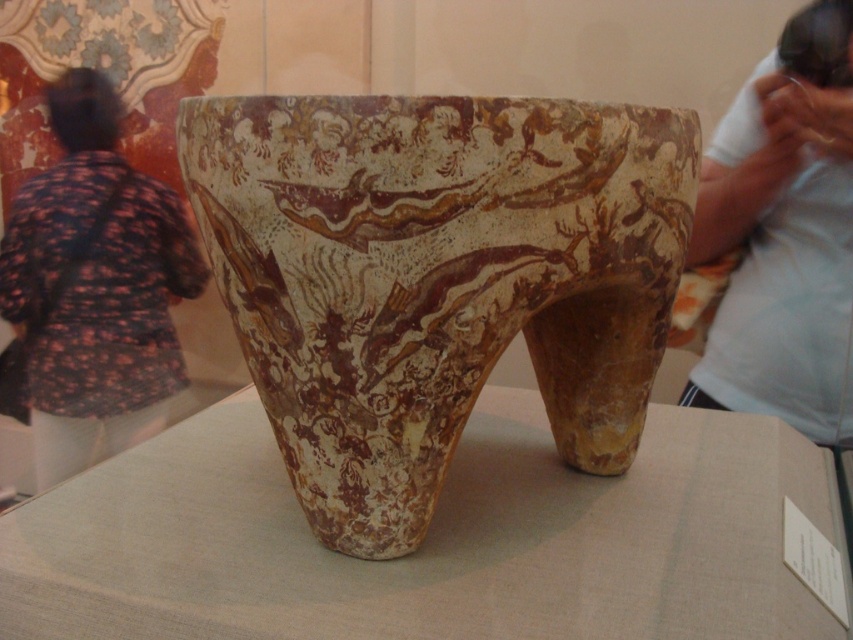
Question: Does brown textured vase at center appear over white cotton shirt at upper right?

Choices:
 (A) yes
 (B) no

Answer: (B)

Question: Can you confirm if brown textured vase at center is thinner than white cotton shirt at upper right?

Choices:
 (A) no
 (B) yes

Answer: (A)

Question: Which object is farther from the camera taking this photo?

Choices:
 (A) brown textured vase at center
 (B) white cotton shirt at upper right
 (C) floral-patterned shirt at left

Answer: (C)

Question: Estimate the real-world distances between objects in this image. Which object is farther from the floral-patterned shirt at left?

Choices:
 (A) brown textured vase at center
 (B) white cotton shirt at upper right

Answer: (A)

Question: Which point is farther to the camera?

Choices:
 (A) (544, 364)
 (B) (80, 403)

Answer: (B)

Question: Is floral-patterned shirt at left further to the viewer compared to white cotton shirt at upper right?

Choices:
 (A) yes
 (B) no

Answer: (A)